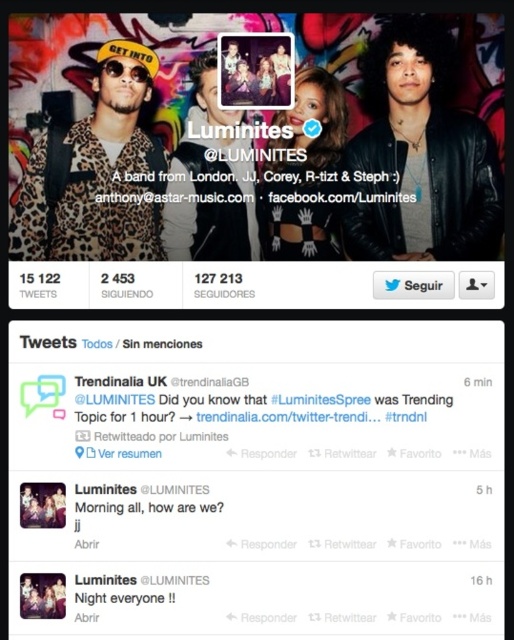
Can you confirm if matte black top at center is positioned to the left of matte black goggles at upper left?

No, matte black top at center is not to the left of matte black goggles at upper left.

This screenshot has height=640, width=514. Identify the location of matte black top at center. [x=303, y=173].

Does point (493, 230) come in front of point (133, 44)?

No, (493, 230) is further to viewer.

In the scene shown: Does leather jacket at right appear under leopard print jacket at upper left?

No, leather jacket at right is not below leopard print jacket at upper left.

Who is more forward, (495, 152) or (67, 150)?

Positioned in front is point (495, 152).

At what (x,y) coordinates should I click in order to perform the action: click on leather jacket at right. Please return your answer as a coordinate pair (x, y). This screenshot has height=640, width=514. Looking at the image, I should click on (419, 156).

Between point (276, 64) and point (141, 72), which one is positioned behind?

The point (276, 64) is more distant.

Which of these two, matte black photo frame at upper center or matte black goggles at upper left, stands shorter?

matte black goggles at upper left is shorter.

Who is more distant from viewer, (219, 49) or (143, 77)?

The point (143, 77) is more distant.

You are a GUI agent. You are given a task and a screenshot of the screen. Output one action in this format:
    pyautogui.click(x=<x>, y=<y>)
    Task: Click on the matte black photo frame at upper center
    
    Given the screenshot: What is the action you would take?
    pyautogui.click(x=255, y=70)